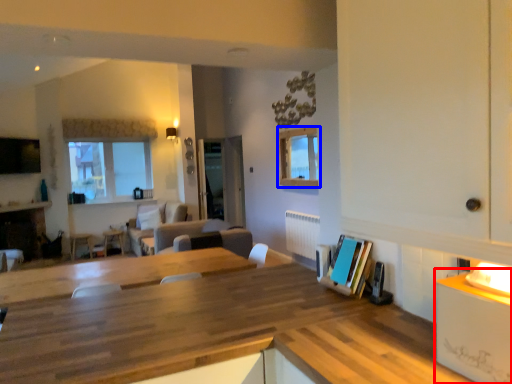
Question: Which point is closer to the camera, counter (highlighted by a red box) or window (highlighted by a blue box)?

Choices:
 (A) counter
 (B) window

Answer: (A)